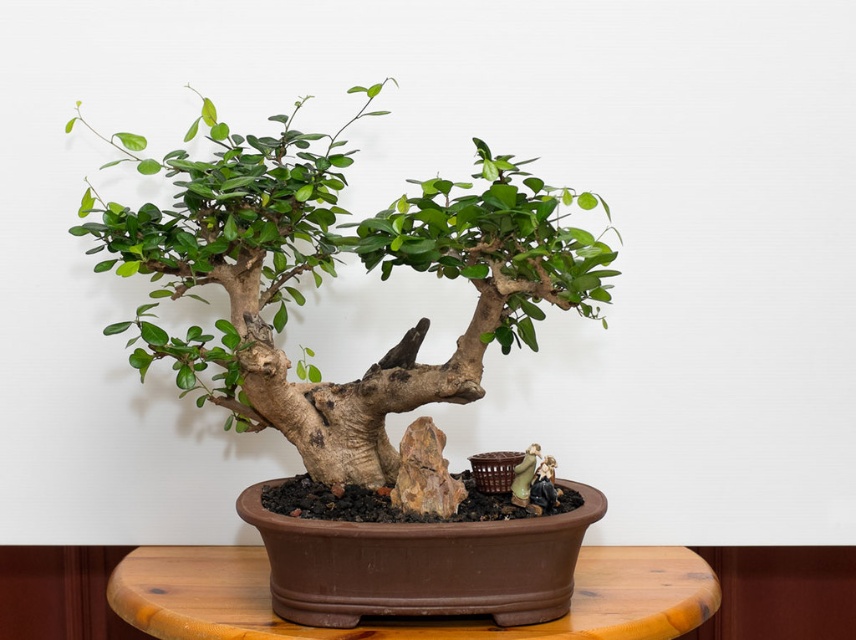
Looking at this image, is green matte bonsai tree at center thinner than brown wooden table at center?

Indeed, green matte bonsai tree at center has a lesser width compared to brown wooden table at center.

Does green matte bonsai tree at center have a lesser height compared to brown wooden table at center?

Incorrect, green matte bonsai tree at center's height does not fall short of brown wooden table at center's.

Locate an element on the screen. green matte bonsai tree at center is located at coordinates (333, 275).

Image resolution: width=856 pixels, height=640 pixels. In order to click on green matte bonsai tree at center in this screenshot , I will do (333, 275).